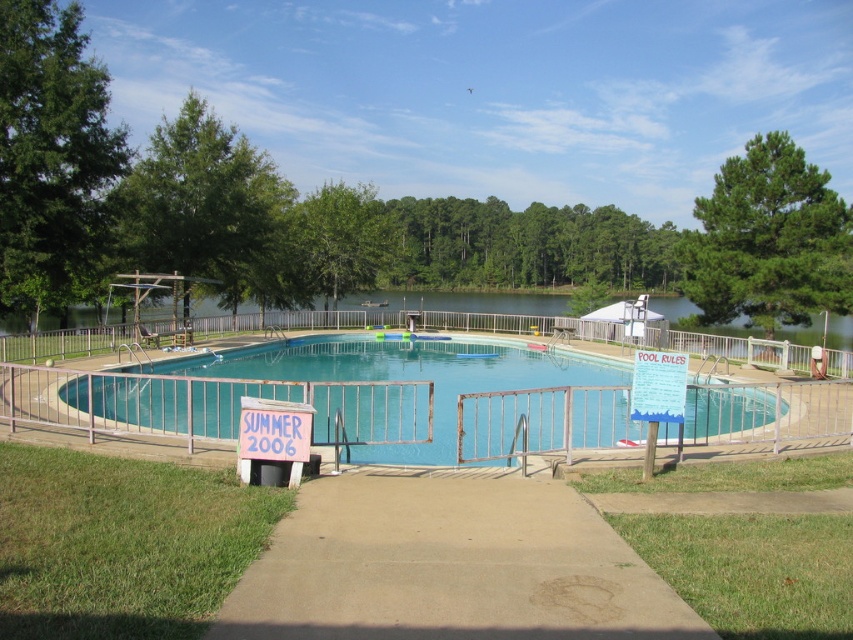
You are standing at the point with coordinates (403, 376) in the image. Based on the scene description, what object are you most likely standing on?

The point at coordinates (403, 376) corresponds to the teal smooth pool at center, so you are most likely standing on the teal smooth pool at center.

You are planning to install a new fence around the teal smooth pool at center and the green pine tree at upper right. Based on their sizes, which one requires a larger fence area?

The green pine tree at upper right requires a larger fence area because it is bigger than the teal smooth pool at center.

Based on the scene description, which tree has a wider spread, the green leafy tree at upper left or the green pine tree at upper right?

The green leafy tree at upper left might be wider than green pine tree at upper right according to the description.